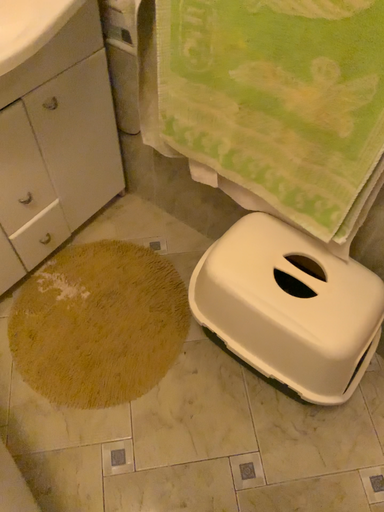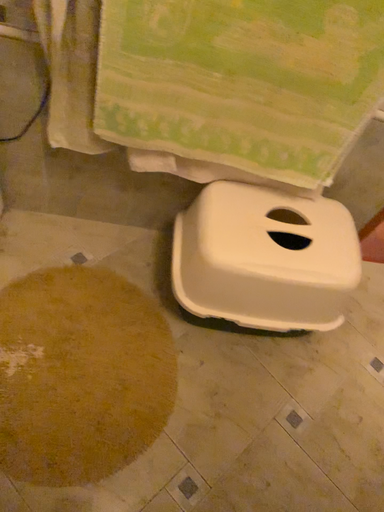
Question: How did the camera likely rotate when shooting the video?

Choices:
 (A) rotated right
 (B) rotated left

Answer: (A)